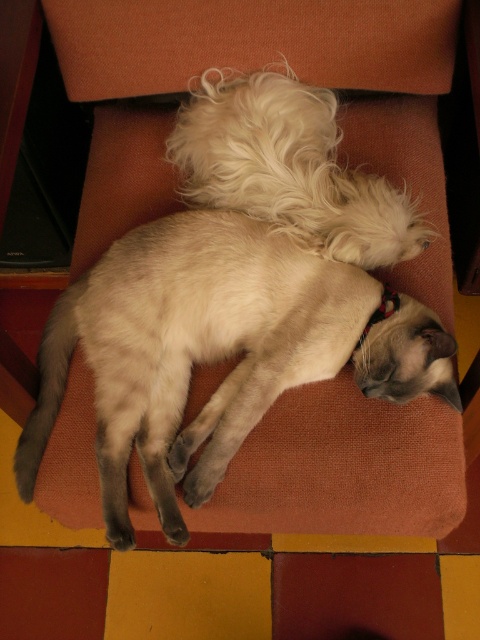
Does silky white cat at center have a lesser width compared to white fluffy dog at upper center?

No.

Is point (130, 256) farther from viewer compared to point (282, 100)?

No, it is in front of (282, 100).

This screenshot has height=640, width=480. In order to click on silky white cat at center in this screenshot , I will do (215, 352).